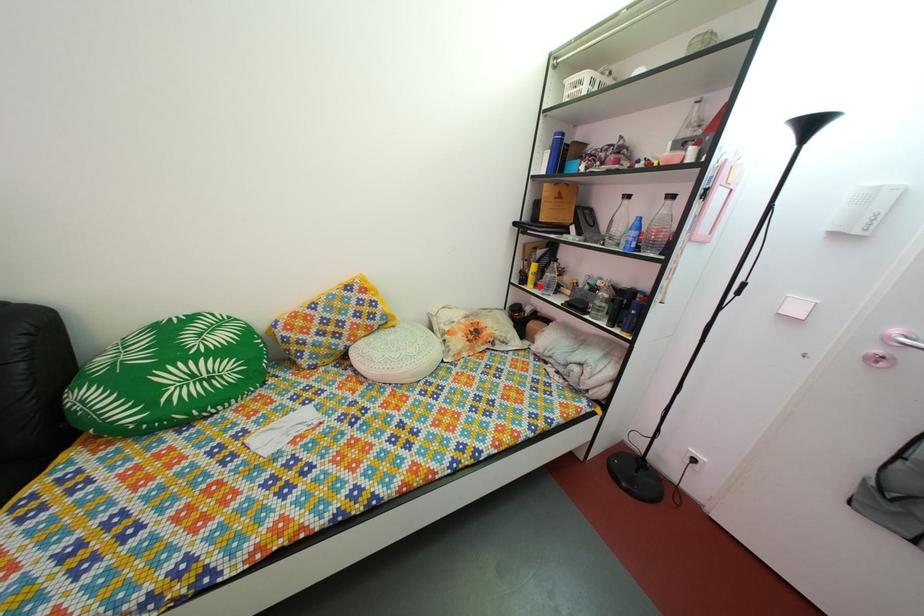
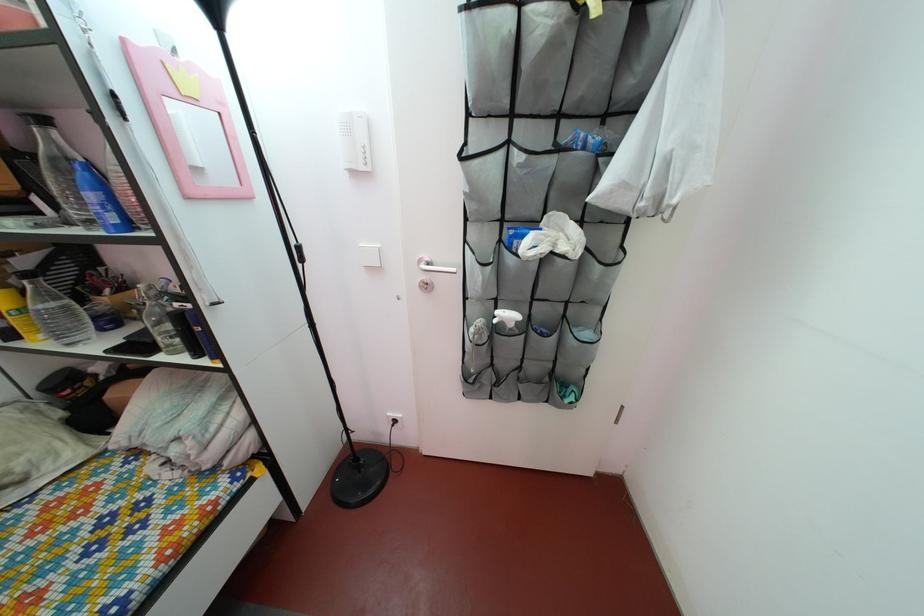
The point at the highlighted location is marked in the first image. Where is the corresponding point in the second image?

(27, 330)